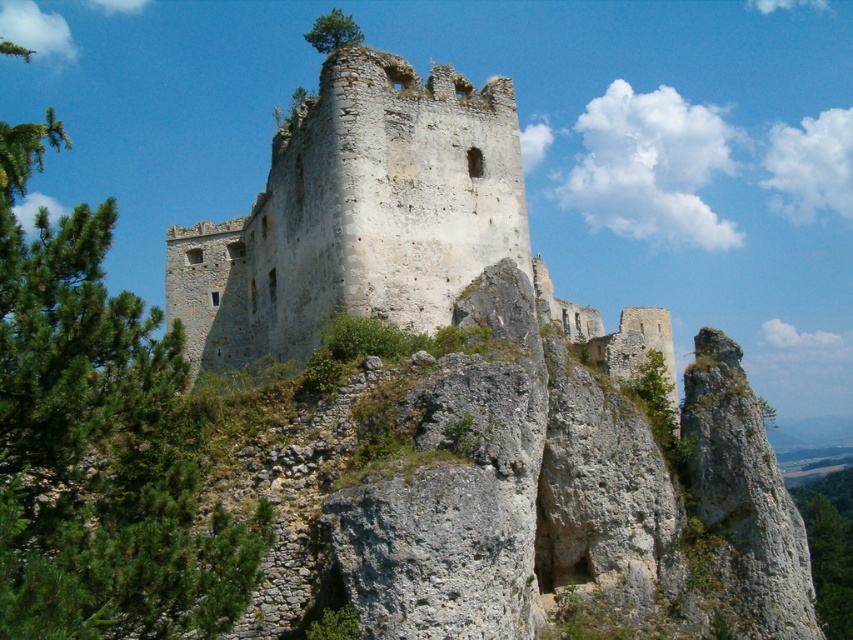
You are standing at the base of the castle and want to take a photo of the castle with the green leafy tree at left in the background. Where should you position yourself to ensure the tree is in the frame?

To include the green leafy tree at left in the photo, position yourself so that the tree is within your camera frame. Since the tree is located at coordinates approximately 0.692 on the x and 0.116 on the y axis, align your camera to capture that area in the background.

You are standing at the base of the castle ruins and want to reach the point marked at coordinates point (173,579). Given that the path to this point is 39.57 meters long, can you estimate how long it would take to walk there at a leisurely pace of 3 meters per minute?

The distance to point (173,579) is 39.57 meters. At a leisurely pace of 3 meters per minute, it would take approximately 13.19 minutes to reach the point.

You are standing at the base of the castle ruins and want to take a photo of the green leafy tree at left. If your camera can focus on objects up to 30 meters away, will you be able to capture the tree clearly?

The green leafy tree at left and camera are 30.72 meters apart from each other. Since the camera can focus up to 30 meters, the distance is slightly beyond its range, so the tree may not be in clear focus.